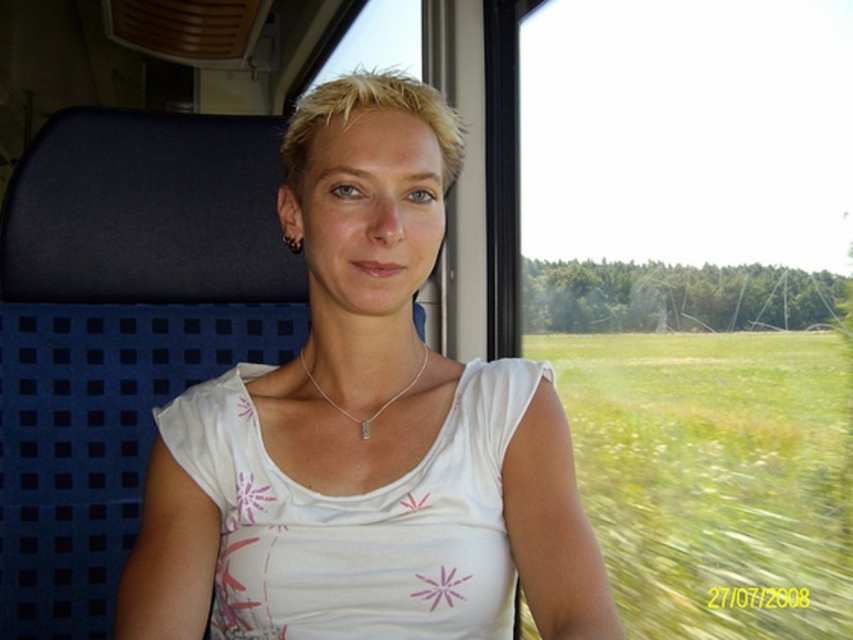
In the scene shown: You are a fashion designer observing a person in a train carriage. You notice the white fabric at center and the silver metallic necklace at center. Which item do you think would be more noticeable from a distance? Please explain your reasoning based on their sizes.

The white fabric at center is larger in size than the silver metallic necklace at center, so the white fabric at center would be more noticeable from a distance due to its bigger size.

You are a passenger on a train and you notice two items at the center of your seat area. One is the white fabric at center and the other is the silver metallic necklace at center. Which item is positioned to the right when looking from your perspective?

The white fabric at center is to the right of the silver metallic necklace at center.